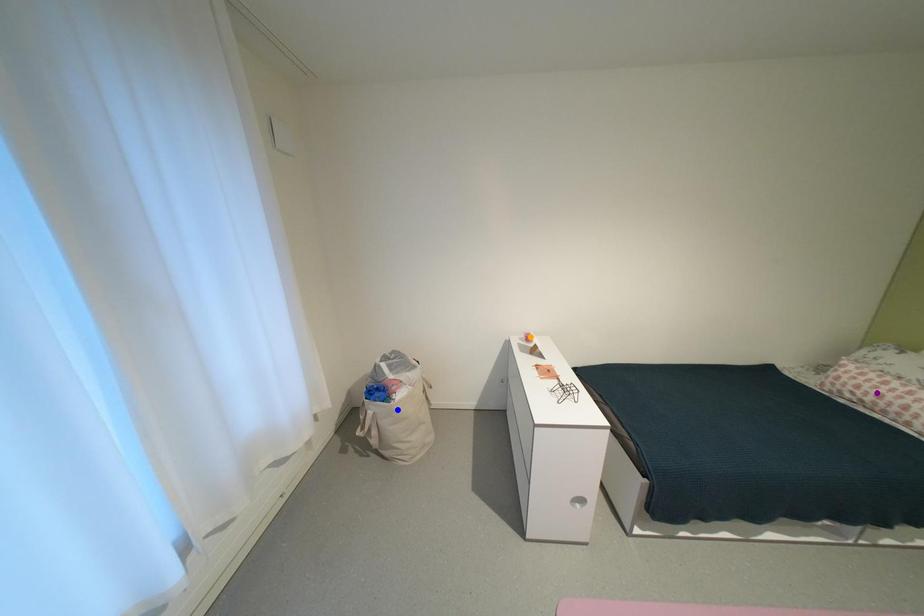
Order these from nearest to farthest:
blue point, purple point, orange point

1. purple point
2. blue point
3. orange point